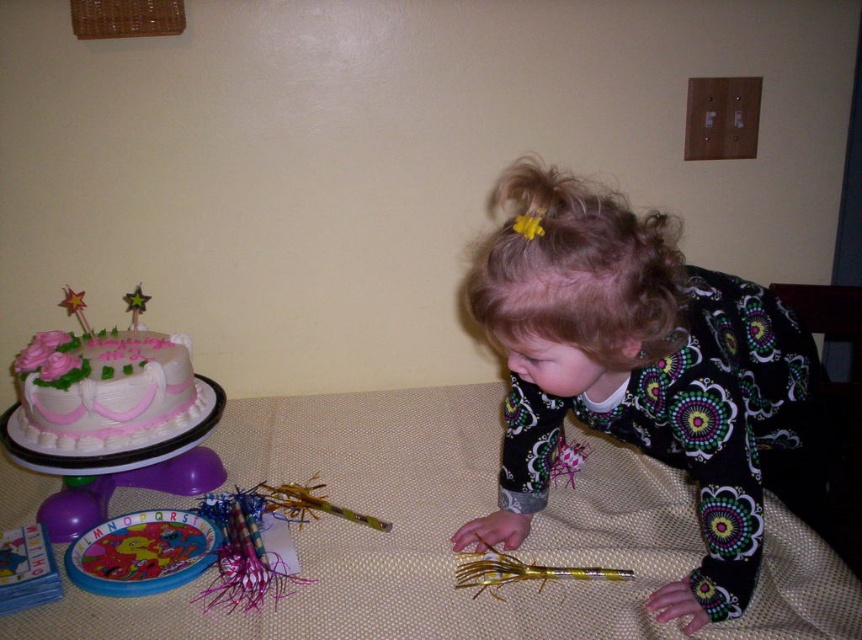
Question: From the image, what is the correct spatial relationship of beige fabric table at lower center in relation to pink frosted cake at left?

Choices:
 (A) left
 (B) right

Answer: (B)

Question: Estimate the real-world distances between objects in this image. Which object is closer to the pink frosted cake at left?

Choices:
 (A) beige fabric table at lower center
 (B) floral-patterned pajamas at lower right

Answer: (A)

Question: Among these objects, which one is nearest to the camera?

Choices:
 (A) floral-patterned pajamas at lower right
 (B) pink frosted cake at left

Answer: (A)

Question: Among these points, which one is farthest from the camera?

Choices:
 (A) (792, 573)
 (B) (111, 360)

Answer: (B)

Question: Is beige fabric table at lower center bigger than floral-patterned pajamas at lower right?

Choices:
 (A) yes
 (B) no

Answer: (A)

Question: Is beige fabric table at lower center wider than floral-patterned pajamas at lower right?

Choices:
 (A) no
 (B) yes

Answer: (B)